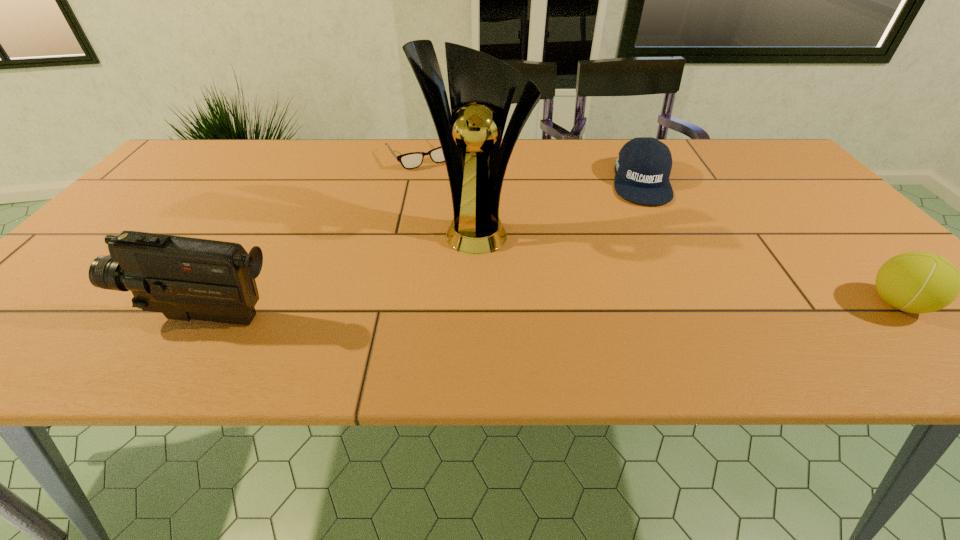
The height and width of the screenshot is (540, 960). I want to click on free spot between the rightmost object and the camcorder, so click(553, 310).

Point out which object is positioned as the third nearest to the fourth tallest object. Please provide its 2D coordinates. Your answer should be formatted as a tuple, i.e. [(x, y)], where the tuple contains the x and y coordinates of a point satisfying the conditions above.

[(412, 160)]

In order to click on object that is the second closest one to the tallest object in this screenshot , I will do `click(643, 166)`.

Locate an element on the screen. The width and height of the screenshot is (960, 540). blank area in the image that satisfies the following two spatial constraints: 1. on the front side of the second object from right to left; 2. on the right side of the spectacles is located at coordinates (415, 181).